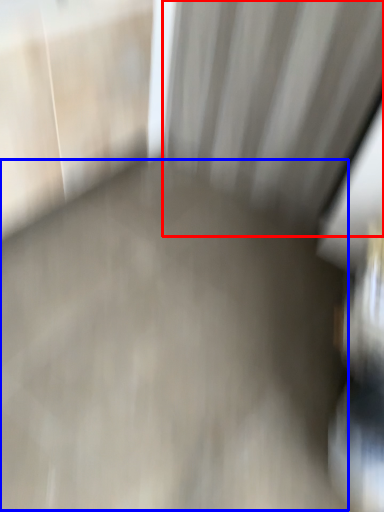
Question: Which object appears farthest to the camera in this image, curtain (highlighted by a red box) or concrete (highlighted by a blue box)?

Choices:
 (A) curtain
 (B) concrete

Answer: (A)